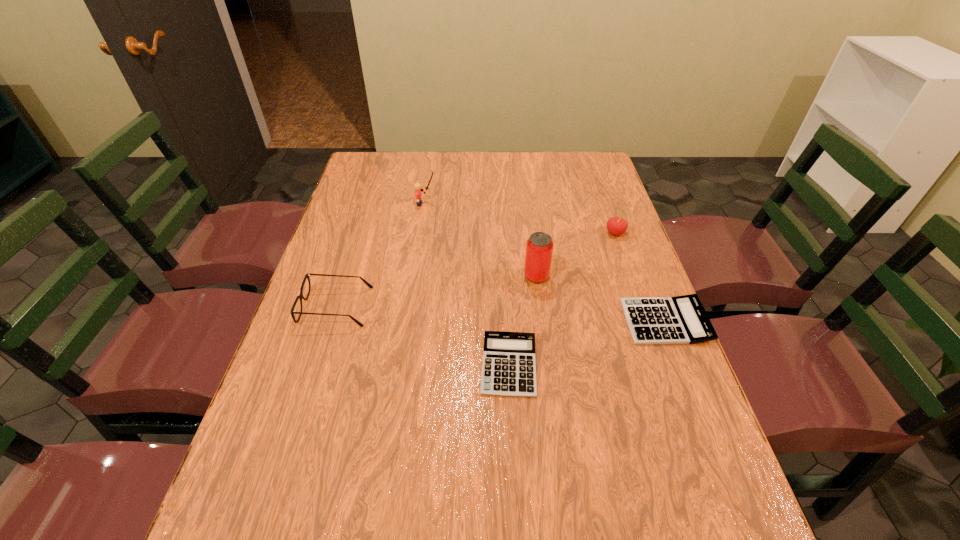
This screenshot has width=960, height=540. Find the location of `free spot at the far edge of the desktop`. free spot at the far edge of the desktop is located at coordinates click(x=507, y=170).

The image size is (960, 540). Find the location of `vacant space at the near edge of the desktop`. vacant space at the near edge of the desktop is located at coordinates (546, 457).

Locate an element on the screen. vacant area at the left edge is located at coordinates (374, 260).

I want to click on vacant area at the right edge of the desktop, so click(x=634, y=366).

In the image, there is a desktop. Where is `vacant area at the far left corner`? vacant area at the far left corner is located at coordinates (353, 181).

The height and width of the screenshot is (540, 960). Identify the location of vacant space at the far right corner of the desktop. (584, 161).

Where is `empty space that is in between the leftmost object and the shortest object`? empty space that is in between the leftmost object and the shortest object is located at coordinates (422, 336).

Locate an element on the screen. Image resolution: width=960 pixels, height=540 pixels. free space between the cherry and the third shortest object is located at coordinates (476, 270).

You are a GUI agent. You are given a task and a screenshot of the screen. Output one action in this format:
    pyautogui.click(x=<x>, y=<y>)
    Task: Click on the free space between the third farthest object and the spectacles
    Image resolution: width=960 pixels, height=540 pixels.
    Given the screenshot: What is the action you would take?
    pyautogui.click(x=436, y=292)

Locate an element on the screen. This screenshot has width=960, height=540. unoccupied area between the spectacles and the Lego is located at coordinates (381, 255).